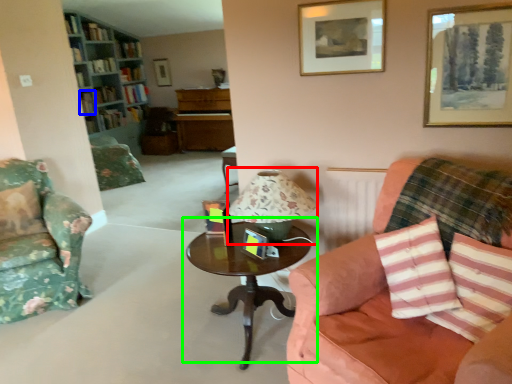
Question: Estimate the real-world distances between objects in this image. Which object is closer to table lamp (highlighted by a red box), book (highlighted by a blue box) or coffee table (highlighted by a green box)?

Choices:
 (A) book
 (B) coffee table

Answer: (B)